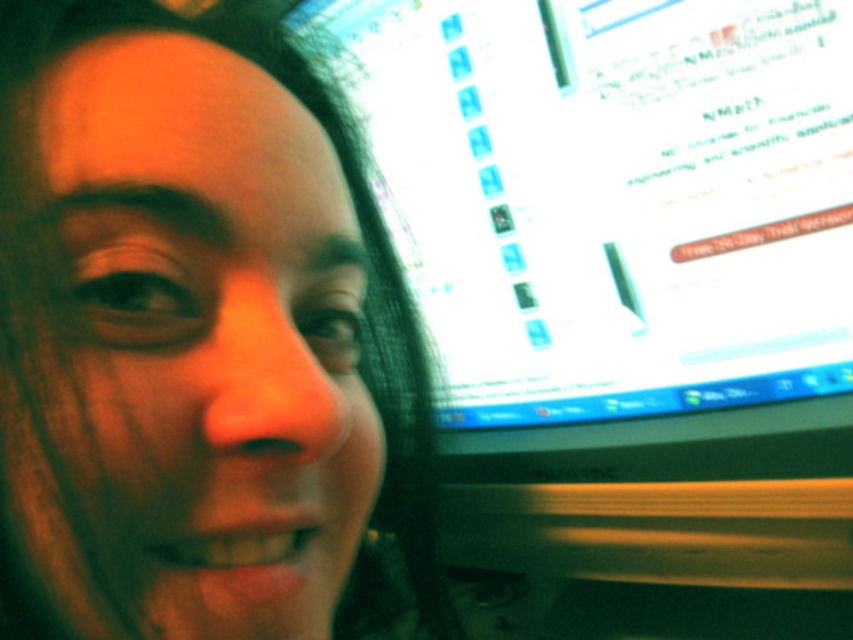
Who is positioned more to the left, matte skin at center or matte plastic monitor at upper right?

matte skin at center is more to the left.

Between matte skin at center and matte plastic monitor at upper right, which one appears on the right side from the viewer's perspective?

matte plastic monitor at upper right is more to the right.

Does point (167, 232) lie in front of point (561, 93)?

That is True.

Locate an element on the screen. This screenshot has height=640, width=853. matte skin at center is located at coordinates (196, 342).